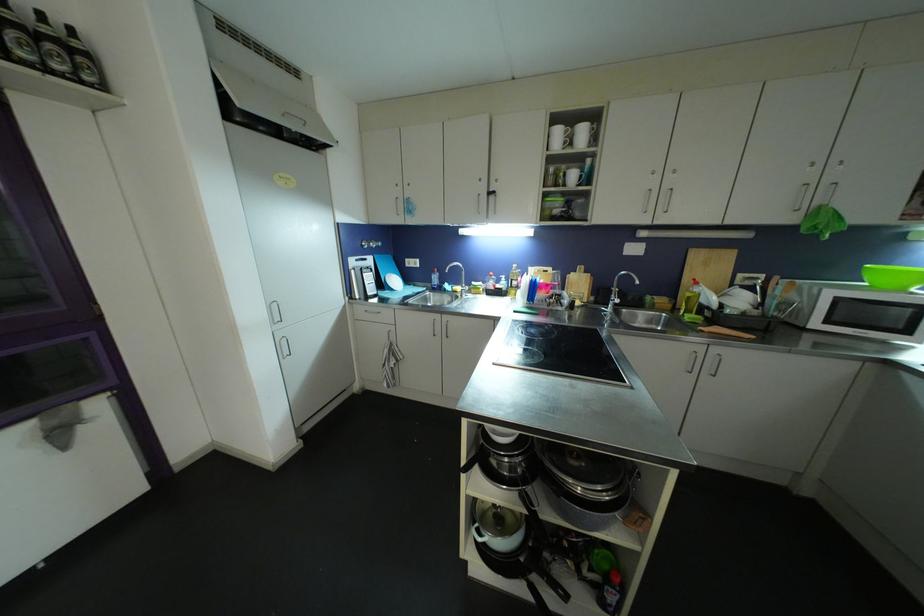
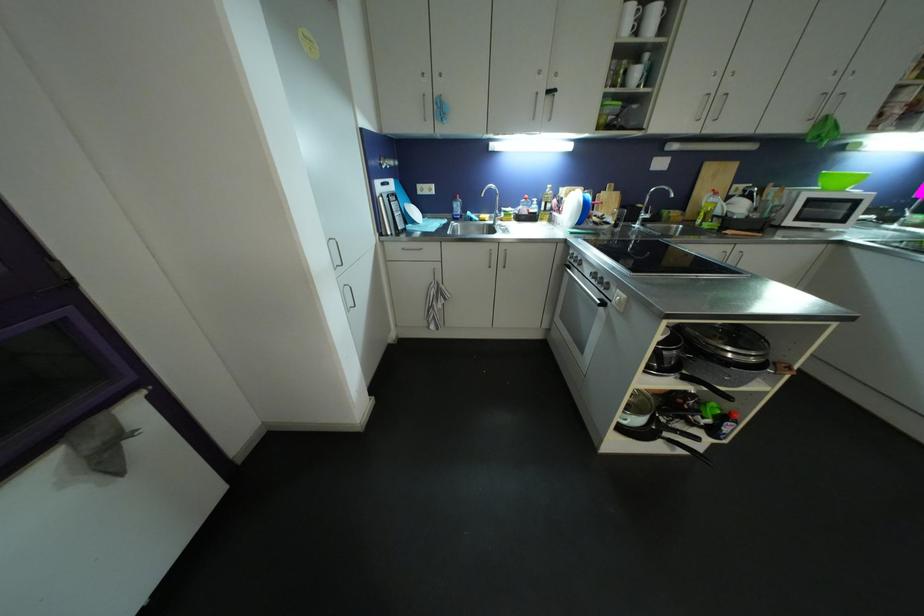
Where in the second image is the point corresponding to point (578, 147) from the first image?

(643, 34)